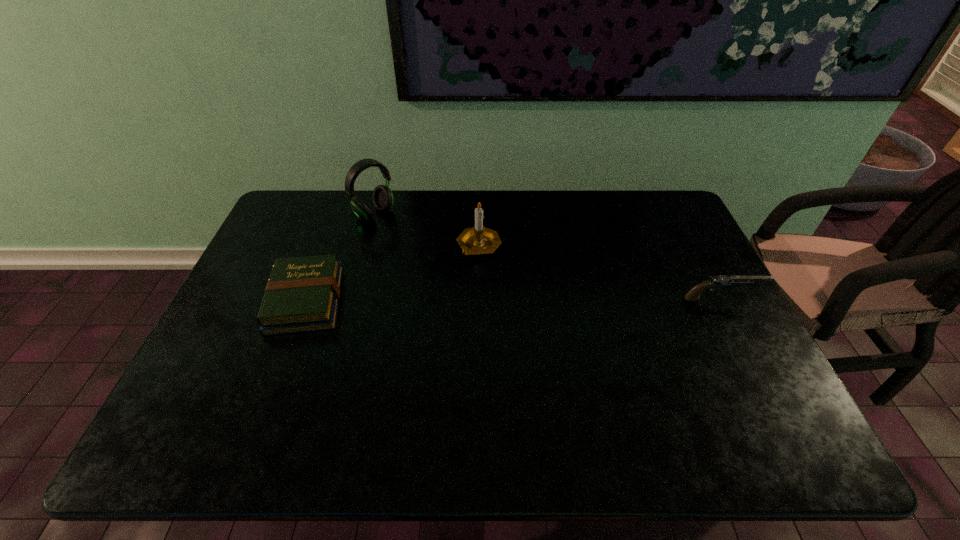
At what (x,y) coordinates should I click in order to perform the action: click on the shortest object. Please return your answer as a coordinate pair (x, y). The image size is (960, 540). Looking at the image, I should click on [302, 294].

The height and width of the screenshot is (540, 960). Find the location of `gun`. gun is located at coordinates (717, 281).

Image resolution: width=960 pixels, height=540 pixels. I want to click on the second shortest object, so click(x=717, y=281).

Identify the location of the farthest object. (383, 199).

You are a GUI agent. You are given a task and a screenshot of the screen. Output one action in this format:
    pyautogui.click(x=<x>, y=<y>)
    Task: Click on the headset
    This screenshot has height=540, width=960.
    Given the screenshot: What is the action you would take?
    pyautogui.click(x=383, y=199)

I want to click on candle holder, so click(x=478, y=240).

Where is `the second tallest object`? the second tallest object is located at coordinates (478, 240).

Identify the location of free region located 0.270m on the back of the shortest object. (338, 213).

Locate an element on the screen. The height and width of the screenshot is (540, 960). vacant space located 0.270m on the ear cups of the farthest object is located at coordinates (437, 264).

The width and height of the screenshot is (960, 540). I want to click on free point located 0.300m on the ear cups of the farthest object, so click(x=444, y=269).